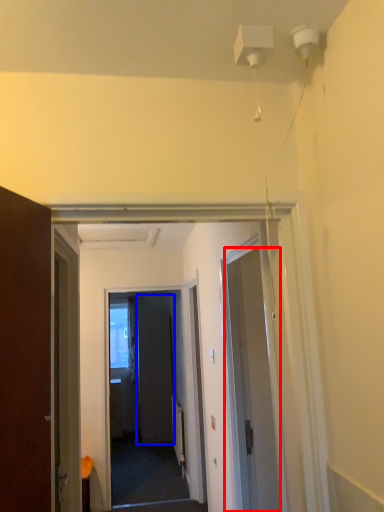
Question: Among these objects, which one is nearest to the camera, door (highlighted by a red box) or screen door (highlighted by a blue box)?

Choices:
 (A) door
 (B) screen door

Answer: (A)